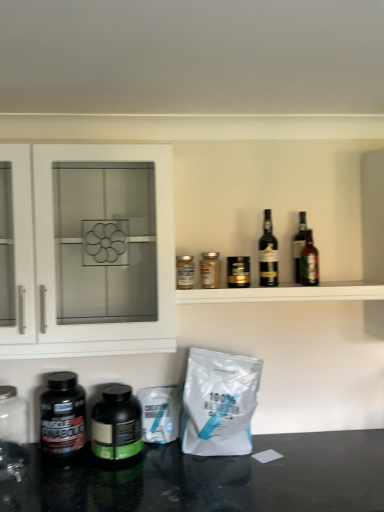
Locate an element on the screen. Image resolution: width=384 pixels, height=512 pixels. vacant space to the right of green glass bottle at upper right, which appears as the second bottle when viewed from the right is located at coordinates (329, 283).